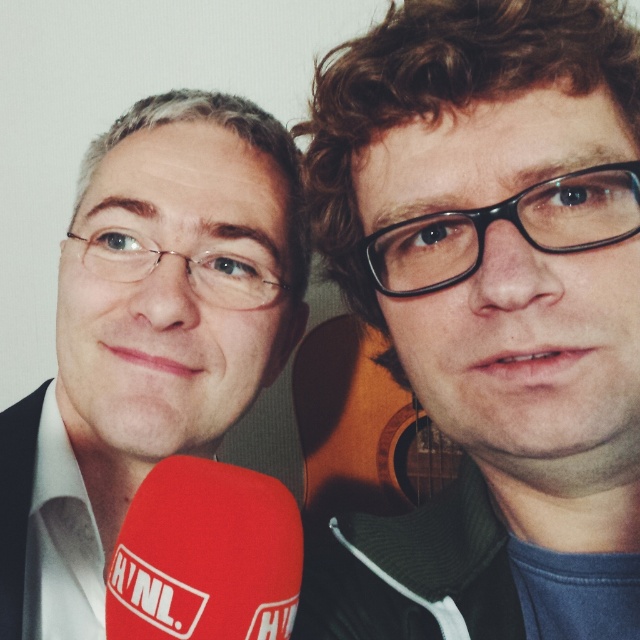
Question: Observing the image, what is the correct spatial positioning of matte black glasses at center in reference to red fabric microphone at lower left?

Choices:
 (A) above
 (B) below

Answer: (A)

Question: Based on their relative distances, which object is nearer to the red fabric microphone at lower left?

Choices:
 (A) matte black suit at left
 (B) matte black glasses at center

Answer: (B)

Question: Among these objects, which one is nearest to the camera?

Choices:
 (A) red fabric microphone at lower left
 (B) matte black glasses at center
 (C) matte black suit at left

Answer: (A)

Question: Can you confirm if matte black glasses at center is wider than matte black suit at left?

Choices:
 (A) no
 (B) yes

Answer: (A)

Question: Can you confirm if matte black glasses at center is bigger than red fabric microphone at lower left?

Choices:
 (A) yes
 (B) no

Answer: (A)

Question: Based on their relative distances, which object is nearer to the red fabric microphone at lower left?

Choices:
 (A) matte black suit at left
 (B) matte black glasses at center

Answer: (B)